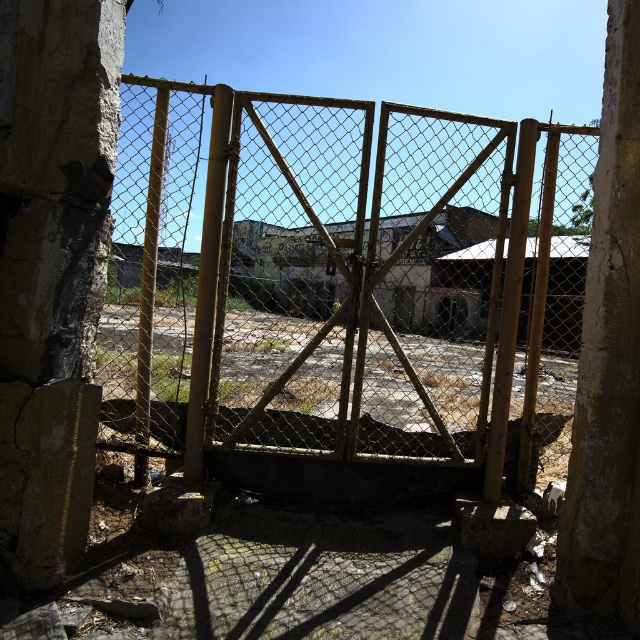
Is cracked concrete pillar at left behind cracked concrete pillar at right?

No.

How distant is cracked concrete pillar at left from cracked concrete pillar at right?

They are 3.59 meters apart.

Who is more forward, (80, 225) or (598, 397)?

Point (80, 225) is more forward.

At what (x,y) coordinates should I click in order to perform the action: click on cracked concrete pillar at left. Please return your answer as a coordinate pair (x, y). Looking at the image, I should click on (52, 268).

Between yellow wire mesh gate at center and cracked concrete pillar at right, which one is positioned higher?

Positioned higher is yellow wire mesh gate at center.

Between yellow wire mesh gate at center and cracked concrete pillar at right, which one appears on the right side from the viewer's perspective?

Positioned to the right is cracked concrete pillar at right.

Locate an element on the screen. The image size is (640, 640). yellow wire mesh gate at center is located at coordinates (346, 289).

Locate an element on the screen. yellow wire mesh gate at center is located at coordinates (346, 289).

In the scene shown: Which is more to the left, yellow wire mesh gate at center or cracked concrete pillar at left?

cracked concrete pillar at left is more to the left.

You are a GUI agent. You are given a task and a screenshot of the screen. Output one action in this format:
    pyautogui.click(x=<x>, y=<y>)
    Task: Click on the yellow wire mesh gate at center
    The height and width of the screenshot is (640, 640).
    Given the screenshot: What is the action you would take?
    pyautogui.click(x=346, y=289)